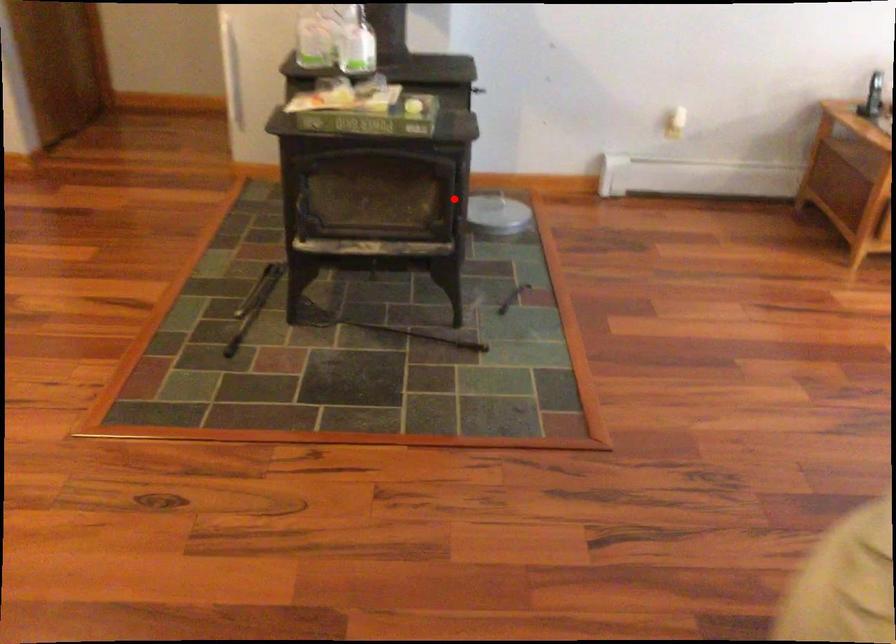
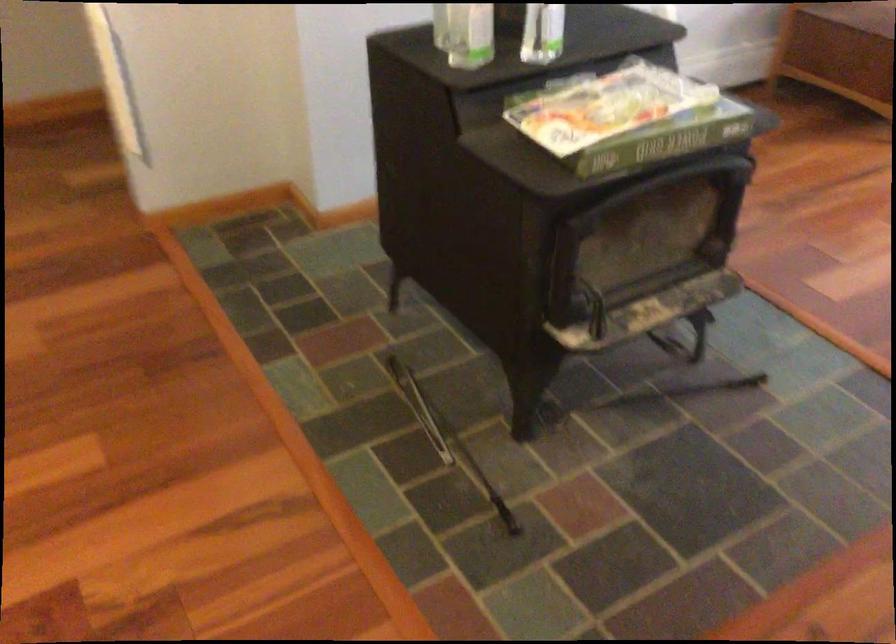
Locate, in the second image, the point that corresponds to the highlighted location in the first image.

(734, 211)